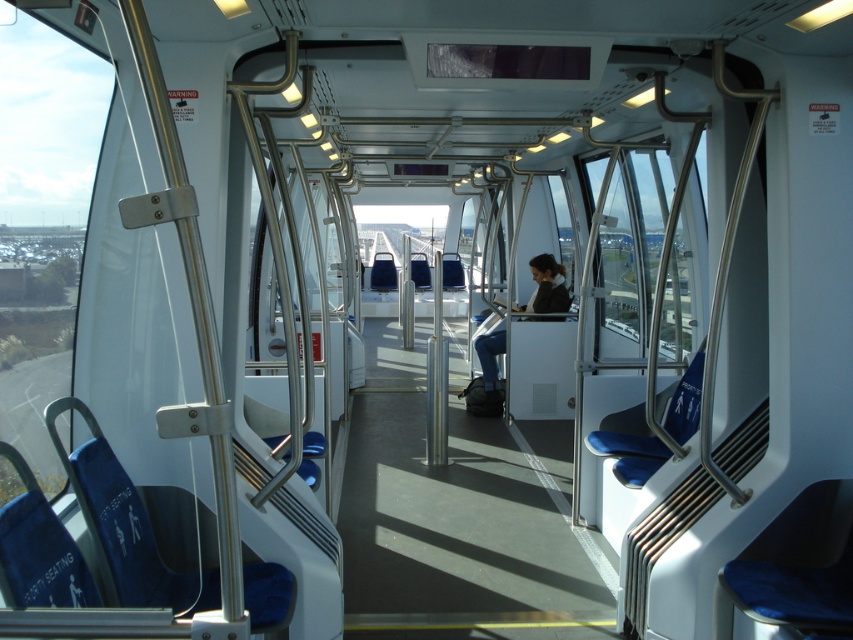
You are a passenger sitting in the dark blue jeans at center. You want to look outside through the clear glass window at center. Is the window positioned in a way that allows you to see out without needing to stand up?

The clear glass window at center is located above dark blue jeans at center, so if the passenger is sitting, they would need to look upward to see outside through the window.

You are a passenger sitting on the dark blue jeans at center in the tram. You want to look outside through the clear glass window at center. Can you reach the window from your current position?

The clear glass window at center is larger in size than dark blue jeans at center, so yes, you can reach the window from your current position as the window is bigger and likely within arm

You are a passenger sitting in the dark blue jeans at center of the tram. You want to look outside through the transparent glass window at left. Can you see the entire height of the window from your seated position?

The transparent glass window at left is much taller than the dark blue jeans at center, so you cannot see the entire height of the window from your seated position because the window extends higher than your height.